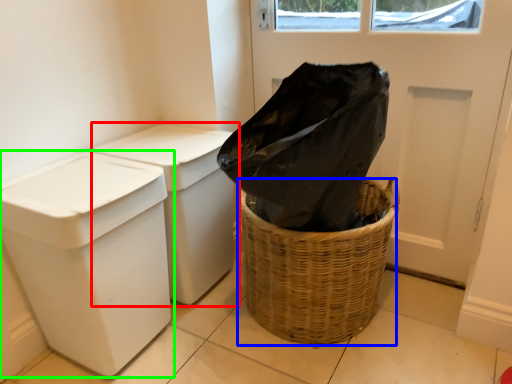
Question: Which is farther away from waste container (highlighted by a red box)? basket container (highlighted by a blue box) or waste container (highlighted by a green box)?

Choices:
 (A) basket container
 (B) waste container

Answer: (A)